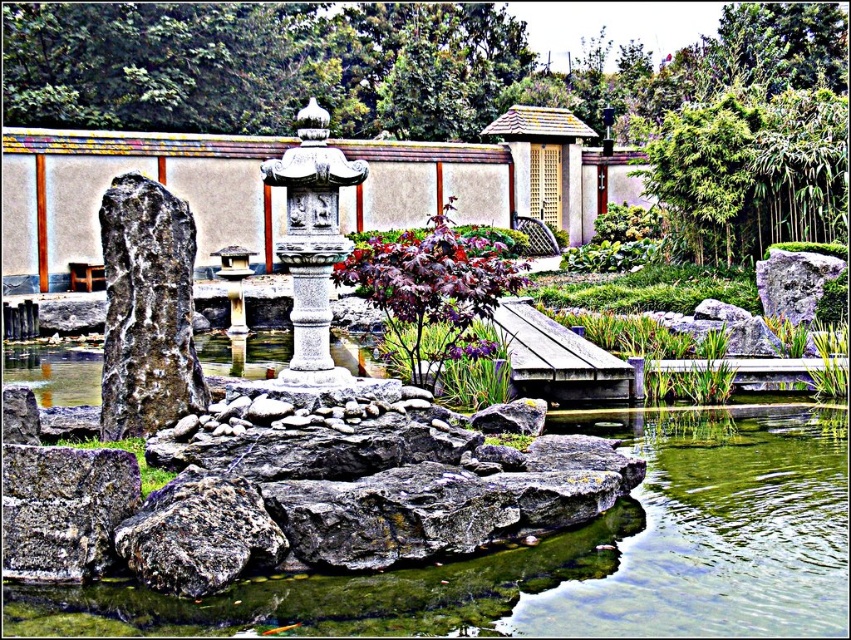
Question: Which of these objects is positioned closest to the purple matte/leathery leaf at center?

Choices:
 (A) gray rough rock at right
 (B) rusty metallic rock at lower left

Answer: (B)

Question: Is greenish water at center to the right of rusty metallic rock at lower left from the viewer's perspective?

Choices:
 (A) no
 (B) yes

Answer: (B)

Question: Which object is positioned farthest from the rusty metallic rock at lower left?

Choices:
 (A) gray rough rock at center
 (B) gray rough rock at right
 (C) purple matte/leathery leaf at center
 (D) greenish water at center

Answer: (B)

Question: In this image, where is greenish water at center located relative to purple matte/leathery leaf at center?

Choices:
 (A) above
 (B) below

Answer: (B)

Question: Which point is closer to the camera?

Choices:
 (A) gray rough rock at center
 (B) purple matte/leathery leaf at center
 (C) gray rough rock at right
 (D) greenish water at center

Answer: (D)

Question: Is greenish water at center positioned behind purple matte/leathery leaf at center?

Choices:
 (A) yes
 (B) no

Answer: (B)